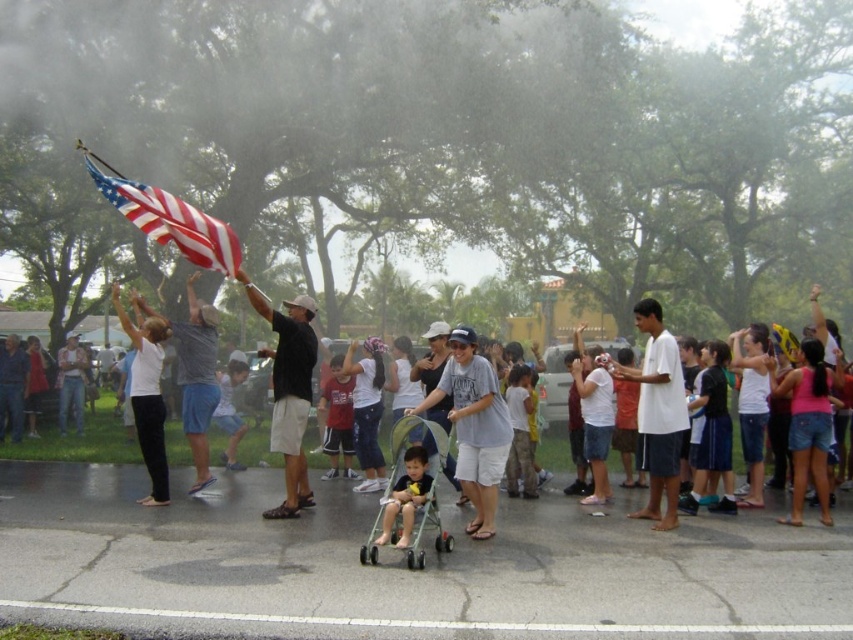
Question: Which of the following is the closest to the observer?

Choices:
 (A) matte gray t-shirt at center
 (B) green plastic stroller at center
 (C) gray cotton t-shirt at upper left
 (D) matte black stroller at center

Answer: (B)

Question: Can you confirm if green plastic stroller at center is smaller than denim shorts at center?

Choices:
 (A) no
 (B) yes

Answer: (A)

Question: Based on their relative distances, which object is nearer to the black cotton shirt at center?

Choices:
 (A) gray cotton t-shirt at upper left
 (B) denim shorts at center

Answer: (A)

Question: Which object appears closest to the camera in this image?

Choices:
 (A) matte red shirt at center
 (B) american flag at upper left
 (C) black cotton shirt at center
 (D) green plastic stroller at center

Answer: (D)

Question: Is white cotton shirt at right smaller than black cotton shirt at center?

Choices:
 (A) yes
 (B) no

Answer: (A)

Question: From the image, what is the correct spatial relationship of matte gray t-shirt at center in relation to matte red shirt at center?

Choices:
 (A) left
 (B) right

Answer: (B)